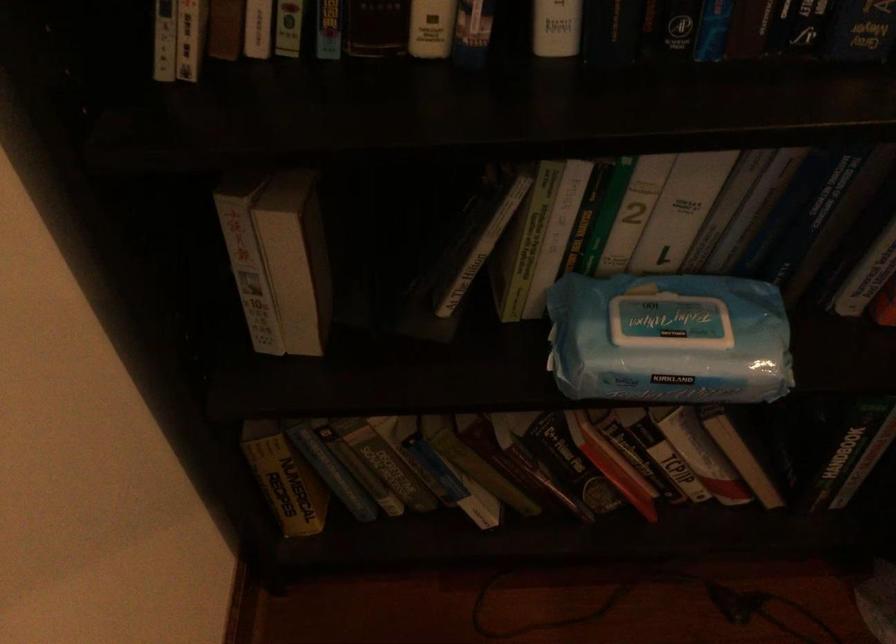
Where would you lift the wipes package flap? Please return your answer as a coordinate pair (x, y).

(673, 317)